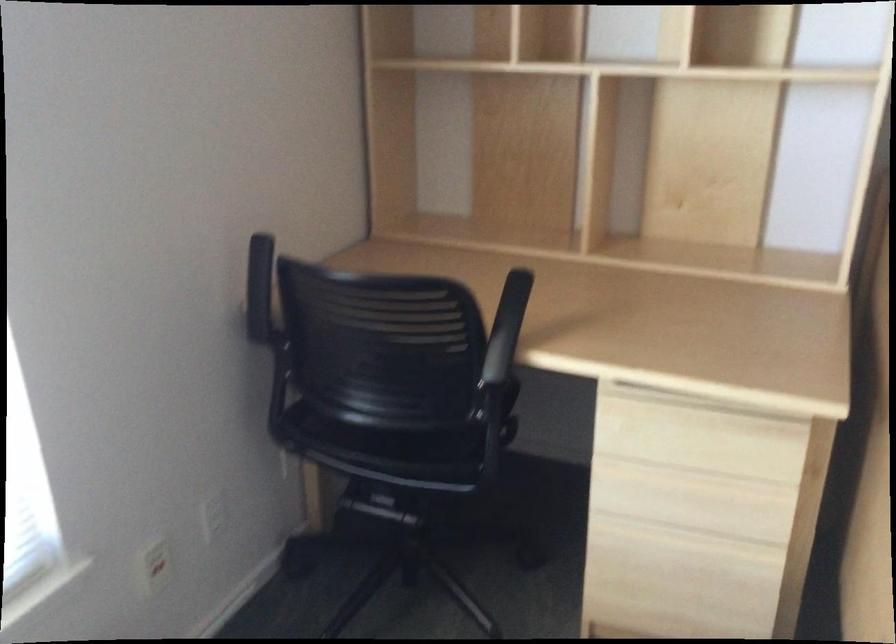
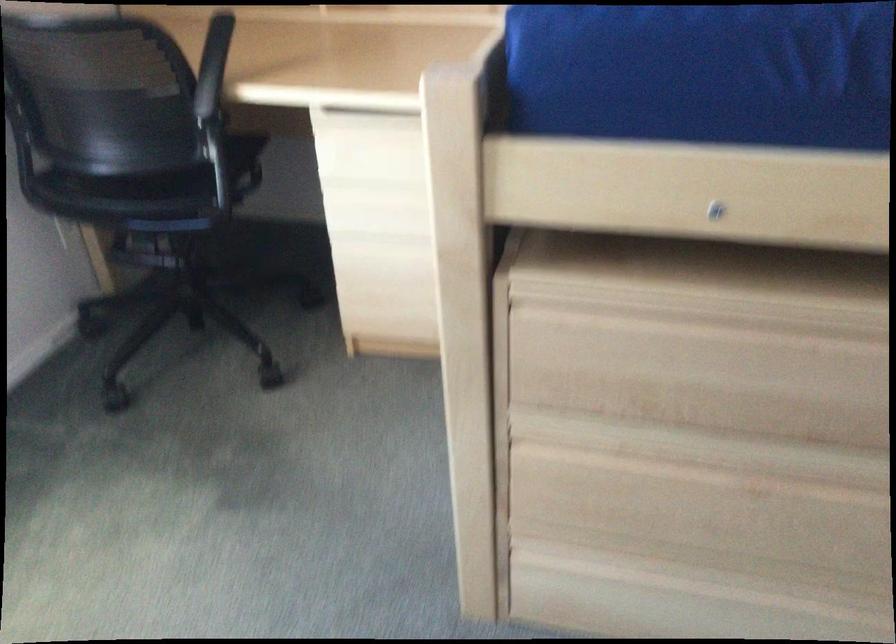
The point at (657, 395) is marked in the first image. Where is the corresponding point in the second image?

(364, 117)